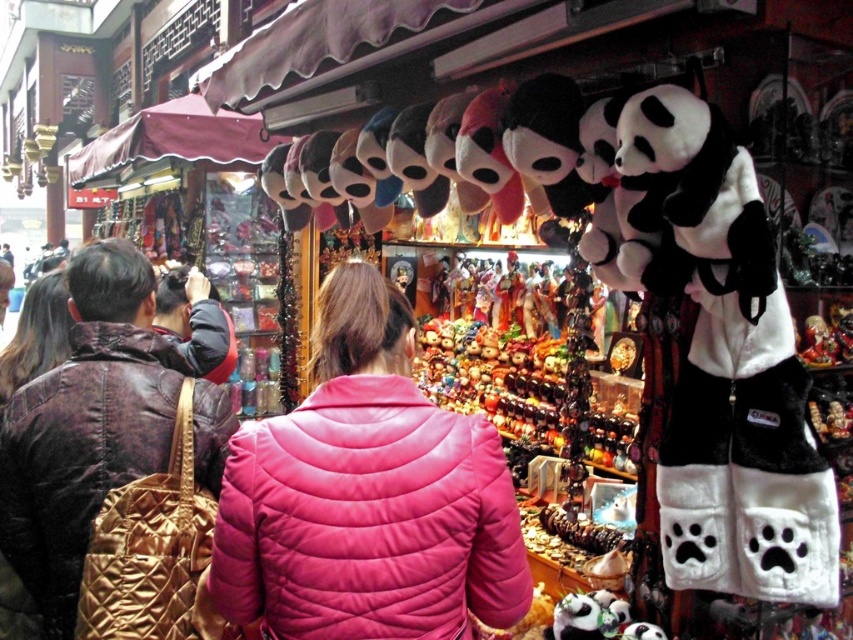
Is point (231, 620) positioned behind point (22, 358)?

No, (231, 620) is in front of (22, 358).

Between point (345, 396) and point (53, 278), which one is positioned in front?

Positioned in front is point (345, 396).

Locate an element on the screen. pink quilted jacket at center is located at coordinates (368, 518).

Where is `pink quilted jacket at center`? The width and height of the screenshot is (853, 640). pink quilted jacket at center is located at coordinates (368, 518).

Who is lower down, leather jacket at left or matte brown leather jacket at left?

leather jacket at left is below.

Between point (148, 460) and point (39, 340), which one is positioned behind?

The point (39, 340) is more distant.

Image resolution: width=853 pixels, height=640 pixels. Identify the location of leather jacket at left. (80, 454).

Does pink quilted jacket at center appear over leather jacket at left?

No.

Can you confirm if pink quilted jacket at center is taller than leather jacket at left?

No, pink quilted jacket at center is not taller than leather jacket at left.

Where is `pink quilted jacket at center`? pink quilted jacket at center is located at coordinates (x=368, y=518).